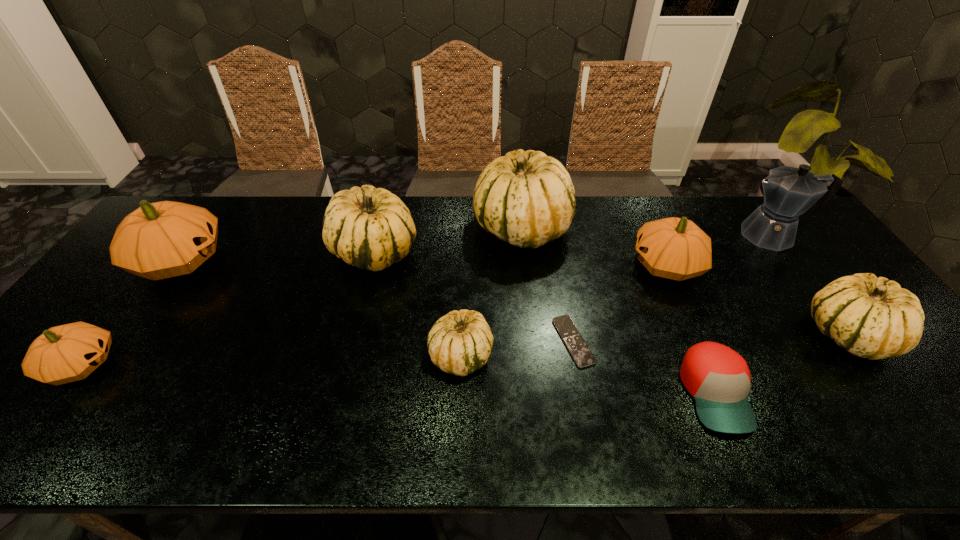
Where is `vacant position located 0.180m on the side of the second biggest orange gourd with the carved face`? vacant position located 0.180m on the side of the second biggest orange gourd with the carved face is located at coordinates (569, 265).

Where is `vacant space situated 0.150m on the side of the second biggest orange gourd with the carved face`? The height and width of the screenshot is (540, 960). vacant space situated 0.150m on the side of the second biggest orange gourd with the carved face is located at coordinates (580, 265).

Locate an element on the screen. free space located on the side of the second biggest orange gourd with the carved face is located at coordinates (576, 265).

At what (x,y) coordinates should I click in order to perform the action: click on free space located 0.070m on the back of the rightmost white gourd. Please return your answer as a coordinate pair (x, y). Looking at the image, I should click on (811, 285).

The width and height of the screenshot is (960, 540). What are the coordinates of `free space located on the side of the nearest orange gourd with the carved face` in the screenshot? It's located at (136, 364).

Identify the location of free point located on the front of the smallest white gourd. (458, 443).

You are a GUI agent. You are given a task and a screenshot of the screen. Output one action in this format:
    pyautogui.click(x=<x>, y=<y>)
    Task: Click on the free space located on the left of the remote control
    
    Given the screenshot: What is the action you would take?
    pyautogui.click(x=420, y=341)

Where is `coffeepot that is at the far edge`? The image size is (960, 540). coffeepot that is at the far edge is located at coordinates (789, 192).

What are the coordinates of `object positioned at the near edge` in the screenshot? It's located at (718, 378).

Locate an element on the screen. coffeepot that is positioned at the right edge is located at coordinates (789, 192).